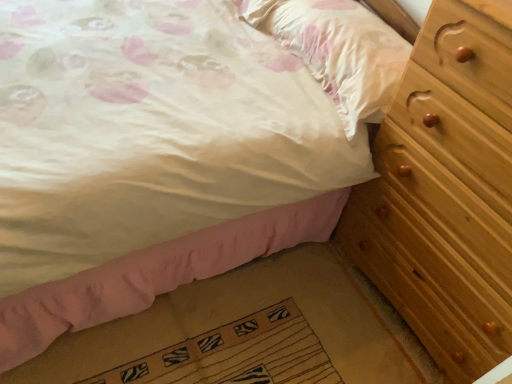
Find the location of a particular element. The height and width of the screenshot is (384, 512). vacant space behind textured beige mat at lower center is located at coordinates (251, 286).